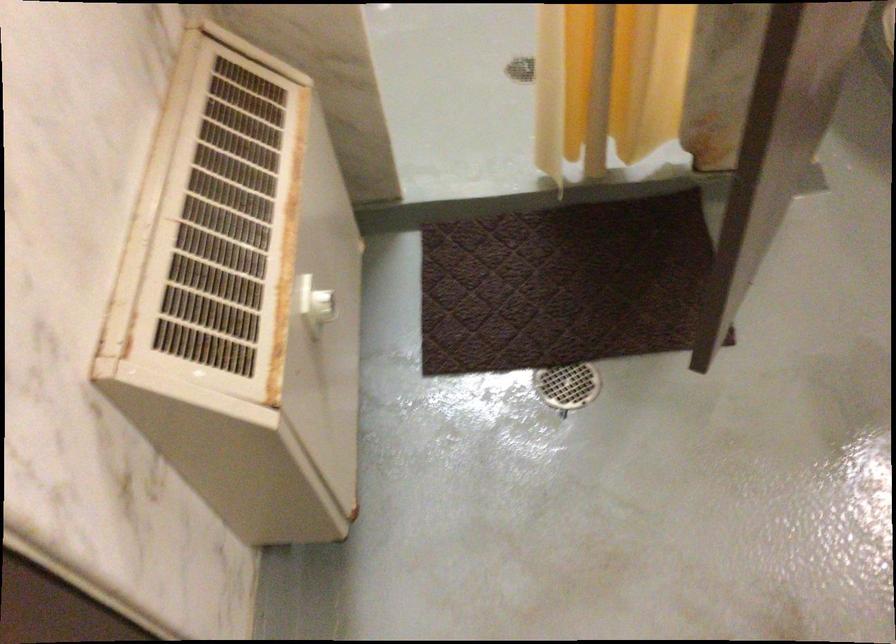
Identify the location of white control knob. (323, 306).